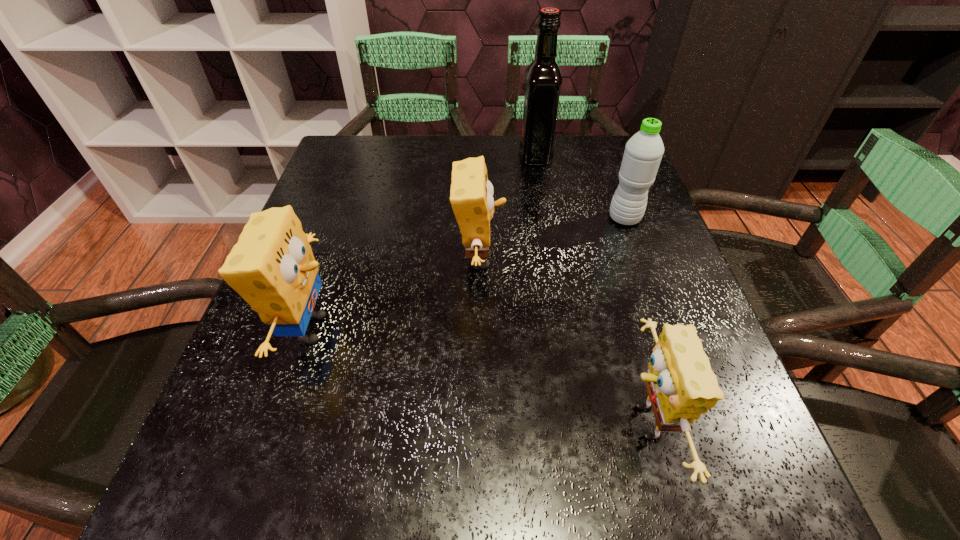
Identify the location of the tallest object. (543, 76).

This screenshot has height=540, width=960. Identify the location of the farthest object. (543, 76).

The height and width of the screenshot is (540, 960). What are the coordinates of `water bottle` in the screenshot? It's located at click(x=643, y=152).

Locate an element on the screen. This screenshot has height=540, width=960. the leftmost sponge is located at coordinates tap(272, 267).

I want to click on the second sponge from right to left, so click(x=471, y=195).

The width and height of the screenshot is (960, 540). I want to click on the rightmost sponge, so point(681,386).

The height and width of the screenshot is (540, 960). Identify the location of the second object from right to left. (681, 386).

This screenshot has height=540, width=960. Find the location of `vacant position located 0.330m on the front-facing side of the farthest object`. vacant position located 0.330m on the front-facing side of the farthest object is located at coordinates (395, 156).

Locate an element on the screen. vacant area located 0.240m on the front-facing side of the farthest object is located at coordinates (429, 156).

Where is `free space located on the front-facing side of the farthest object`? free space located on the front-facing side of the farthest object is located at coordinates (459, 156).